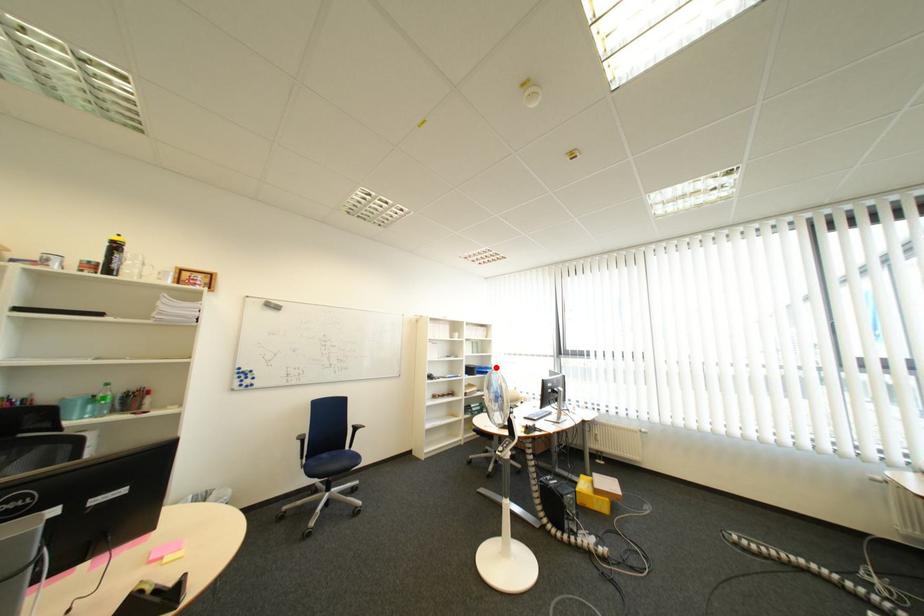
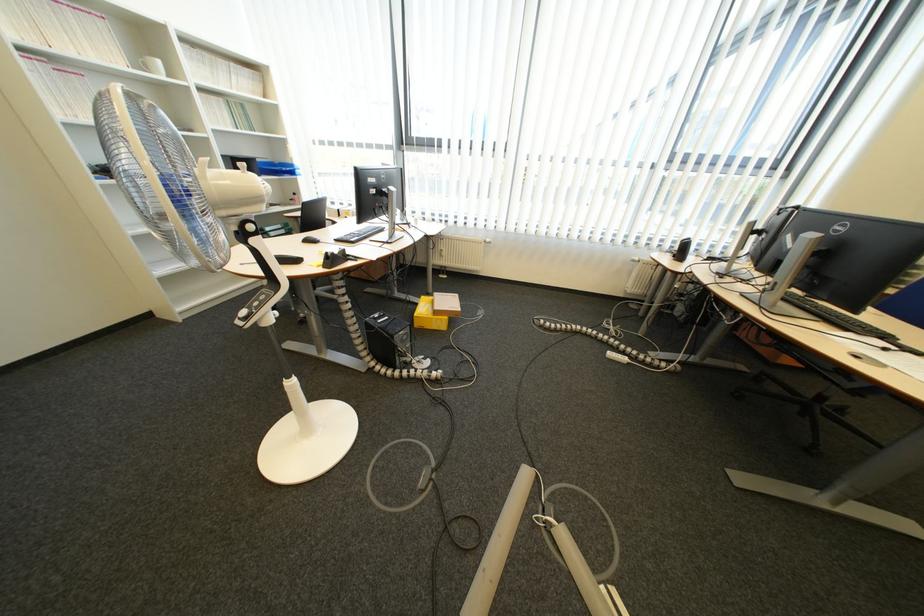
Question: I am providing you with two images of the same scene from different viewpoints. Given a red point in image1, look at the same physical point in image2. Is it:

Choices:
 (A) Closer to the viewpoint
 (B) Farther from the viewpoint

Answer: (A)